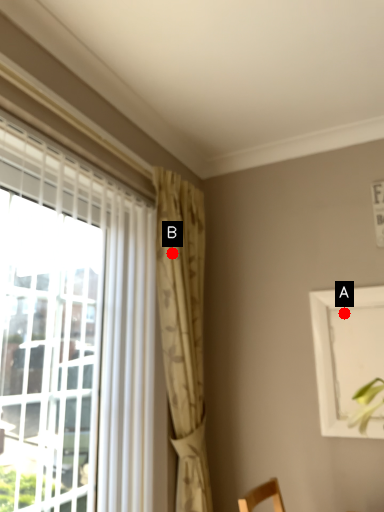
Question: Two points are circled on the image, labeled by A and B beside each circle. Among these points, which one is nearest to the camera?

Choices:
 (A) A is closer
 (B) B is closer

Answer: (B)